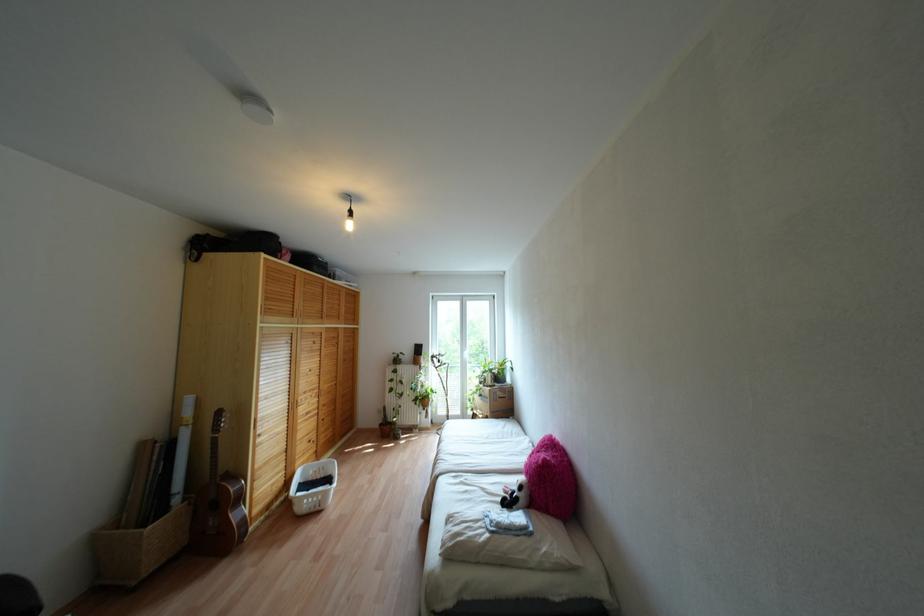
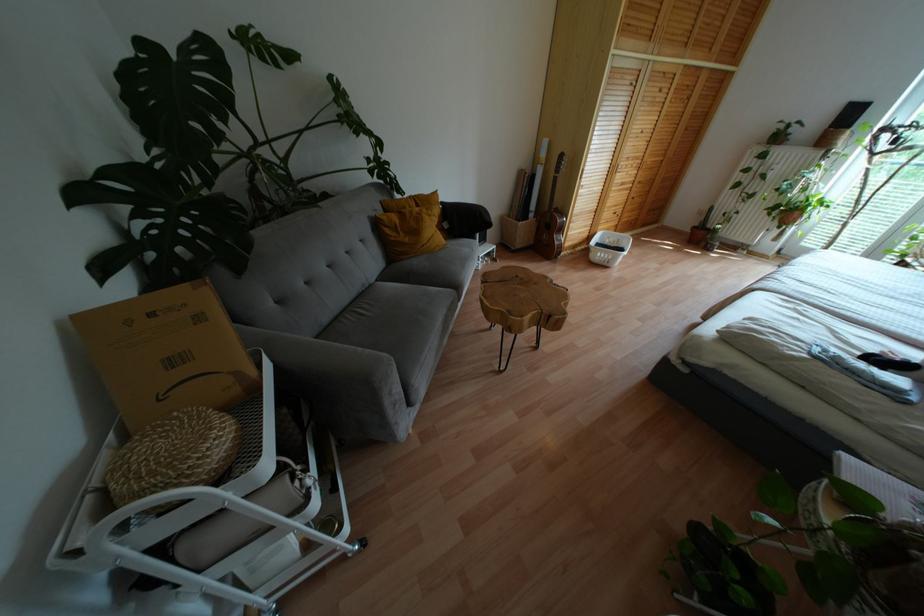
Where in the second image is the point corresponding to point (317, 508) from the first image?

(604, 262)